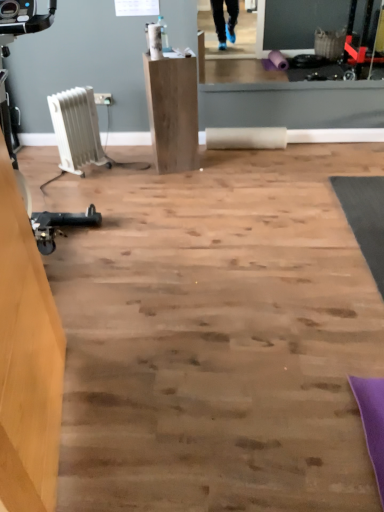
Find the location of a particular element. Image resolution: width=384 pixels, height=512 pixels. free spot to the right of wooden desk at left, acting as the 1th furniture starting from the left is located at coordinates (182, 418).